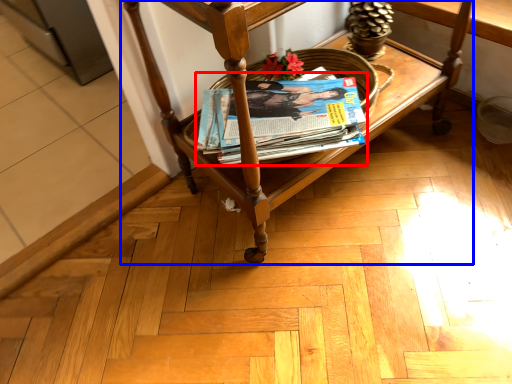
Question: Which object appears farthest to the camera in this image, magazine (highlighted by a red box) or furniture (highlighted by a blue box)?

Choices:
 (A) magazine
 (B) furniture

Answer: (A)